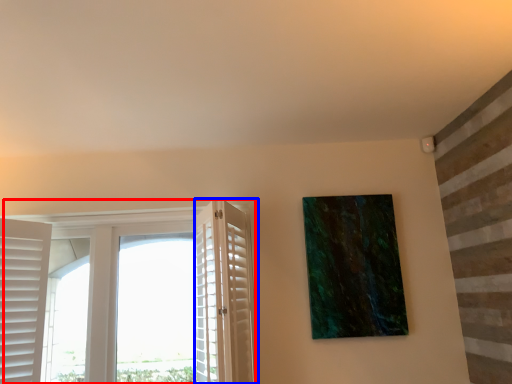
Question: Among these objects, which one is nearest to the camera, window (highlighted by a red box) or screen door (highlighted by a blue box)?

Choices:
 (A) window
 (B) screen door

Answer: (B)